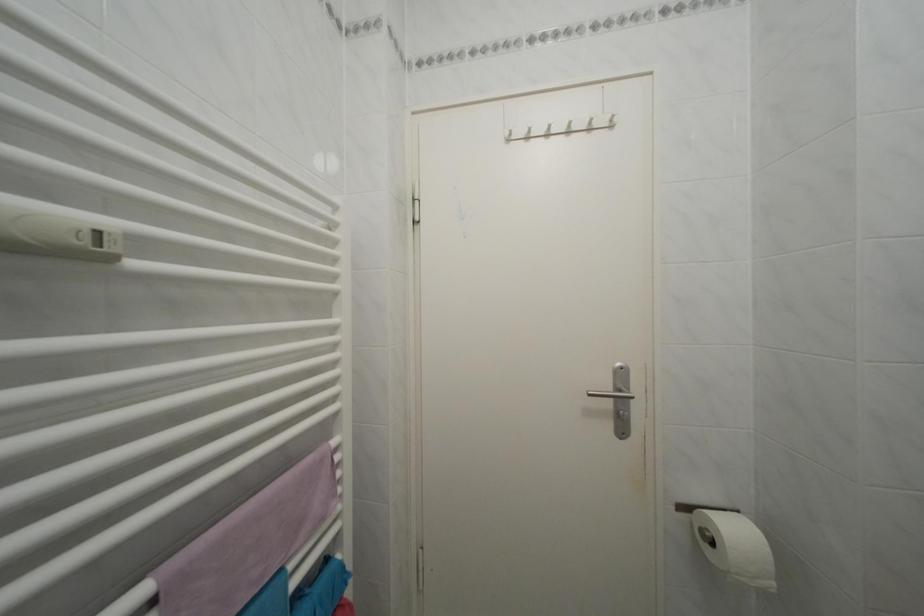
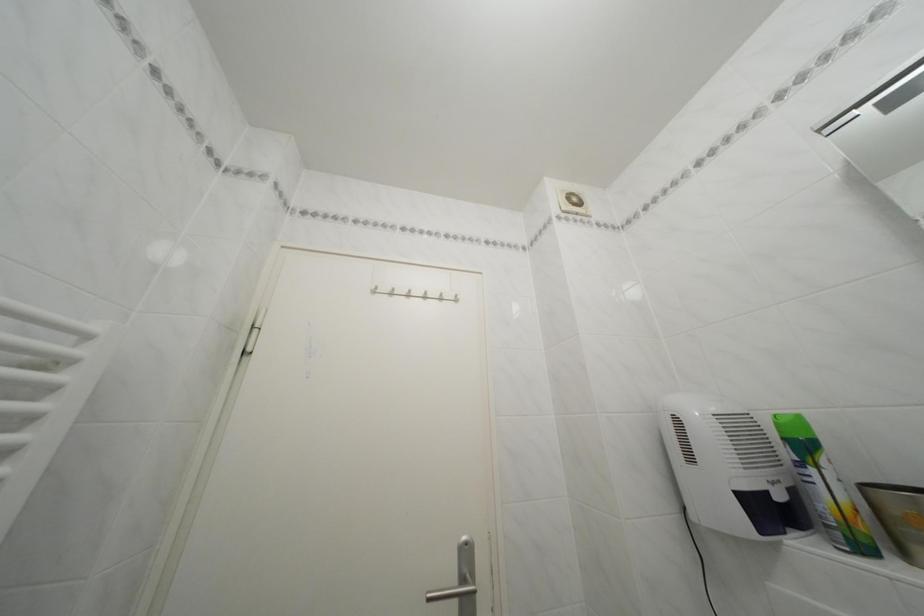
Find the pixel in the second image that matches (x=518, y=140) in the first image.

(385, 294)